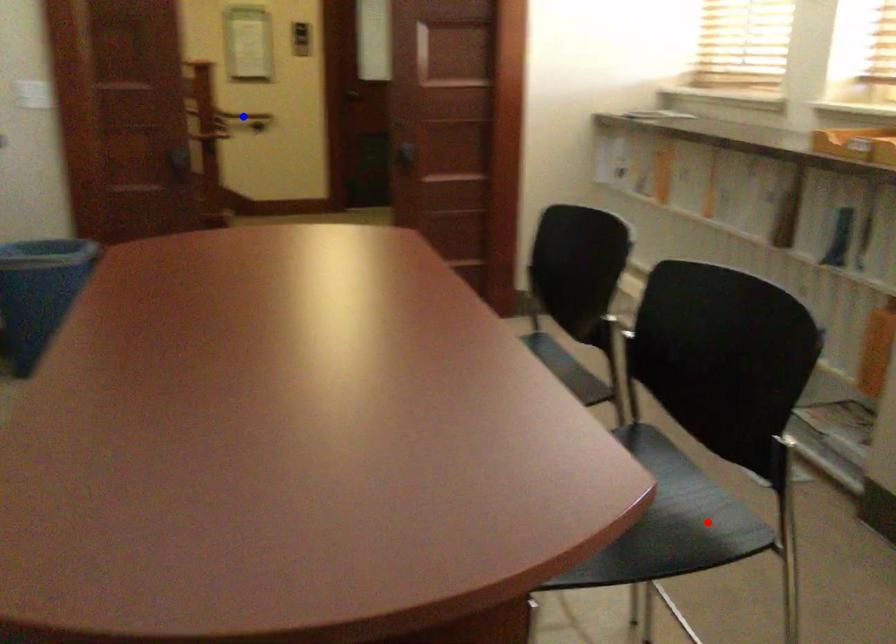
Question: Two points are marked on the image. Which point is closer to the camera?

Choices:
 (A) Blue point is closer.
 (B) Red point is closer.

Answer: (B)